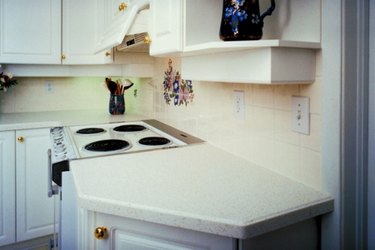
The height and width of the screenshot is (250, 375). What are the coordinates of `top left burner` in the screenshot? It's located at (132, 126).